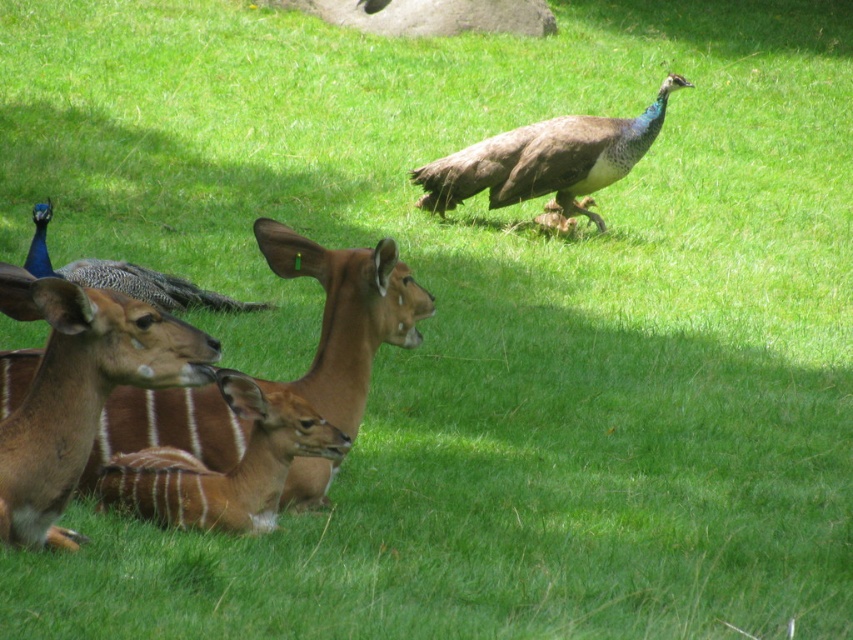
Question: Does brown feathered peacock at upper right appear on the right side of blue glossy peacock at left?

Choices:
 (A) no
 (B) yes

Answer: (B)

Question: Which object is closer to the camera taking this photo?

Choices:
 (A) brown velvet deer at lower left
 (B) brown velvet antelope at left

Answer: (A)

Question: Which is nearer to the brown feathered peacock at upper right?

Choices:
 (A) brown velvet deer at lower left
 (B) brown velvet antelope at left

Answer: (B)

Question: Can you confirm if brown velvet antelope at left is positioned to the right of brown feathered peacock at upper right?

Choices:
 (A) no
 (B) yes

Answer: (A)

Question: Which point is closer to the camera?

Choices:
 (A) blue glossy peacock at left
 (B) brown velvet antelope at left

Answer: (B)

Question: Does brown velvet antelope at left appear over brown velvet deer at left?

Choices:
 (A) yes
 (B) no

Answer: (B)